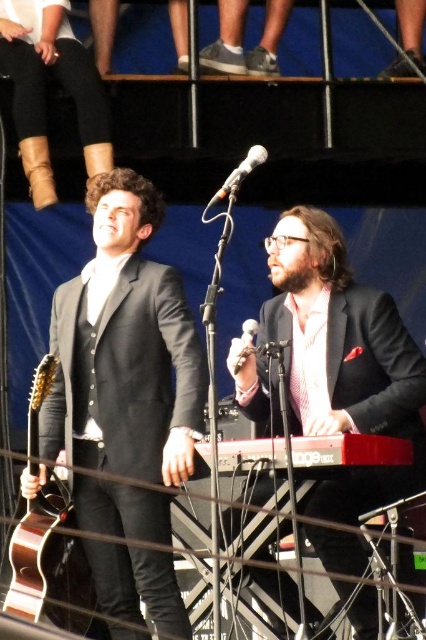
Is matte black suit at left to the left of matte black suit at center from the viewer's perspective?

Indeed, matte black suit at left is positioned on the left side of matte black suit at center.

How far apart are matte black suit at left and matte black suit at center?

matte black suit at left is 13.69 feet away from matte black suit at center.

Is point (135, 196) positioned after point (258, 362)?

Yes, it is behind point (258, 362).

Locate an element on the screen. matte black suit at left is located at coordinates (124, 348).

Which is more to the right, metallic keyboard at center or metallic silver microphone at center?

metallic keyboard at center is more to the right.

Does metallic keyboard at center appear on the right side of metallic silver microphone at center?

Yes, metallic keyboard at center is to the right of metallic silver microphone at center.

Which is behind, point (353, 436) or point (255, 321)?

Positioned behind is point (255, 321).

Where is `metallic keyboard at center`? metallic keyboard at center is located at coordinates (350, 451).

Is the position of wooden acoustic guitar at left less distant than that of metallic keyboard at center?

No, it is not.

Is point (37, 548) closer to viewer compared to point (336, 454)?

No, (37, 548) is further to viewer.

Where is `wooden acoustic guitar at left`? wooden acoustic guitar at left is located at coordinates (51, 566).